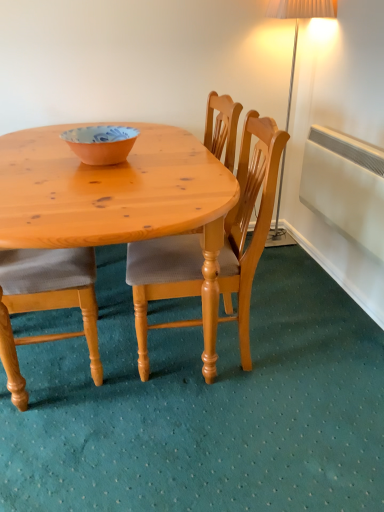
The image size is (384, 512). What do you see at coordinates (249, 219) in the screenshot?
I see `light brown wooden chair at center` at bounding box center [249, 219].

Find the location of a particular element. matte orange bowl at center is located at coordinates (101, 143).

Identify the location of light brown wooden chair at center. [249, 219].

Which of these two, matte orange bowl at center or white plastic radiator at right, is bigger?

white plastic radiator at right.

Choose the correct answer: Is matte orange bowl at center inside white plastic radiator at right or outside it?

matte orange bowl at center lies outside white plastic radiator at right.

Which of these two, matte orange bowl at center or white plastic radiator at right, is thinner?

With smaller width is white plastic radiator at right.

Consider the image. Is light brown wooden chair at center next to white plastic radiator at right and touching it?

No, light brown wooden chair at center is not next to white plastic radiator at right.

From a real-world perspective, is light brown wooden chair at center below white plastic radiator at right?

Yes, from a real-world perspective, light brown wooden chair at center is below white plastic radiator at right.

Looking at this image, from the image's perspective, which one is positioned higher, light brown wooden chair at center or white plastic radiator at right?

From the image's view, white plastic radiator at right is above.

Which of these two, light brown wooden chair at center or white plastic radiator at right, is thinner?

With smaller width is white plastic radiator at right.

Which is more to the left, light brown wooden chair at center or matte orange bowl at center?

matte orange bowl at center.

Is point (243, 234) more distant than point (116, 127)?

No, (243, 234) is closer to viewer.

From the image's perspective, is light brown wooden chair at center on top of matte orange bowl at center?

No, from the image's perspective, light brown wooden chair at center is not above matte orange bowl at center.

Can you tell me how much light brown wooden chair at center and matte orange bowl at center differ in facing direction?

The angular difference between light brown wooden chair at center and matte orange bowl at center is 88.2 degrees.

Which of these two, matte orange bowl at center or light brown wooden chair at center, is wider?

light brown wooden chair at center is wider.

From the image's perspective, which object appears higher, matte orange bowl at center or light brown wooden chair at center?

matte orange bowl at center is shown above in the image.

Is matte orange bowl at center in front of light brown wooden chair at center?

No, matte orange bowl at center is behind light brown wooden chair at center.

This screenshot has width=384, height=512. I want to click on bowl above the light brown wooden chair at center (from the image's perspective), so click(101, 143).

Choose the correct answer: Is white plastic radiator at right inside matte orange bowl at center or outside it?

white plastic radiator at right is spatially situated outside matte orange bowl at center.

Between white plastic radiator at right and matte orange bowl at center, which one has larger size?

Bigger between the two is white plastic radiator at right.

Is white plastic radiator at right behind matte orange bowl at center?

Yes, white plastic radiator at right is behind matte orange bowl at center.

In the scene shown: Who is taller, white plastic radiator at right or matte orange bowl at center?

Standing taller between the two is white plastic radiator at right.

Based on the photo, does white plastic radiator at right have a larger size compared to light brown wooden chair at center?

No.

Is point (329, 192) positioned after point (247, 350)?

Yes, point (329, 192) is farther from viewer.

Who is shorter, white plastic radiator at right or light brown wooden chair at center?

white plastic radiator at right.

Would you say white plastic radiator at right is outside light brown wooden chair at center?

Yes, white plastic radiator at right is outside of light brown wooden chair at center.

I want to click on radiator behind the matte orange bowl at center, so click(x=345, y=186).

I want to click on chair that appears in front of the white plastic radiator at right, so click(249, 219).

Estimate the real-world distances between objects in this image. Which object is closer to matte orange bowl at center, white plastic radiator at right or light brown wooden chair at center?

light brown wooden chair at center.

From the image, which object appears to be farther from white plastic radiator at right, light brown wooden chair at center or matte orange bowl at center?

The object further to white plastic radiator at right is matte orange bowl at center.

Which object lies nearer to the anchor point matte orange bowl at center, light brown wooden chair at center or white plastic radiator at right?

The object closer to matte orange bowl at center is light brown wooden chair at center.

Which object lies further to the anchor point light brown wooden chair at center, white plastic radiator at right or matte orange bowl at center?

Among the two, white plastic radiator at right is located further to light brown wooden chair at center.

Estimate the real-world distances between objects in this image. Which object is closer to white plastic radiator at right, matte orange bowl at center or light brown wooden chair at center?

Based on the image, light brown wooden chair at center appears to be nearer to white plastic radiator at right.

Looking at the image, which one is located closer to light brown wooden chair at center, matte orange bowl at center or white plastic radiator at right?

Among the two, matte orange bowl at center is located nearer to light brown wooden chair at center.

Where is `chair between matte orange bowl at center and white plastic radiator at right`? chair between matte orange bowl at center and white plastic radiator at right is located at coordinates (249, 219).